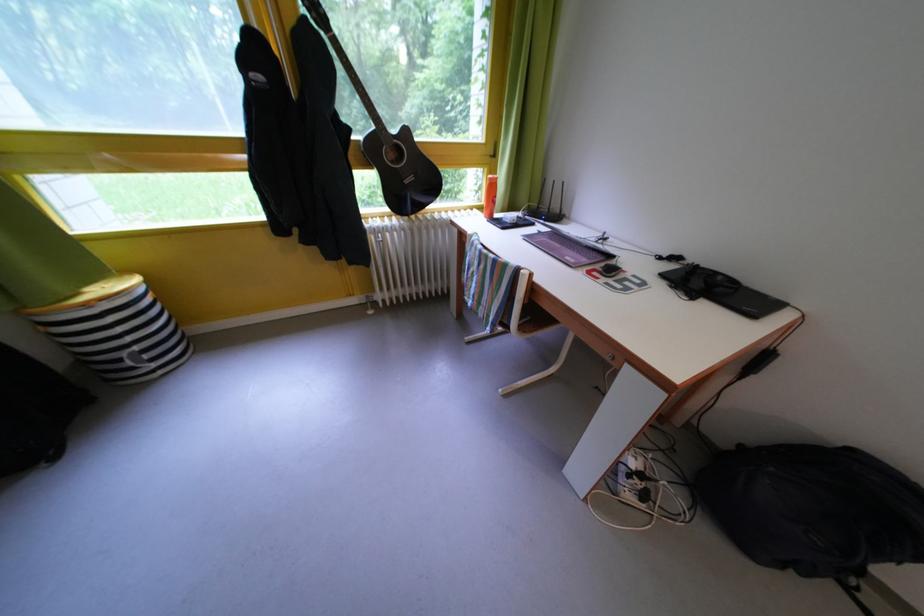
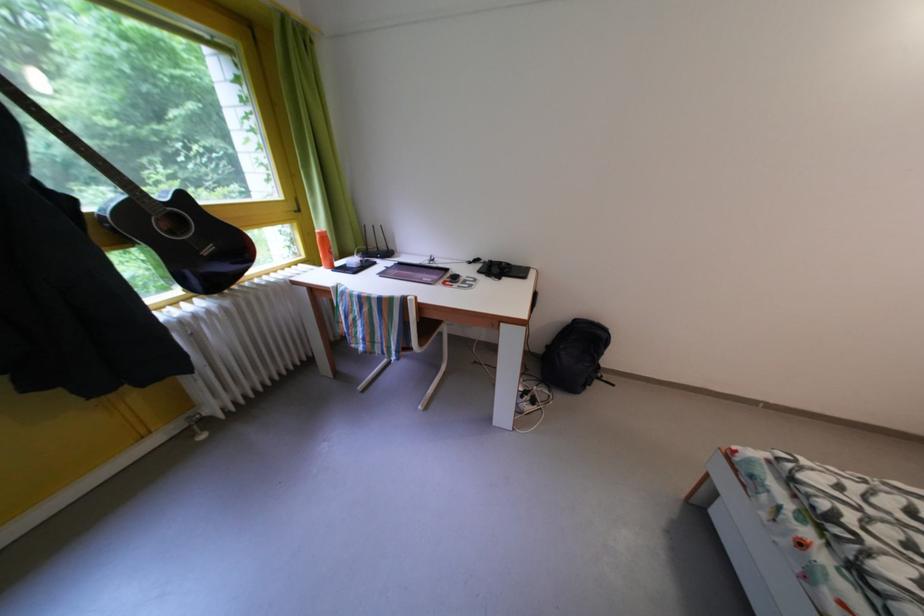
Locate, in the second image, the point that corresponds to the point at 541,230 in the first image.

(383, 270)